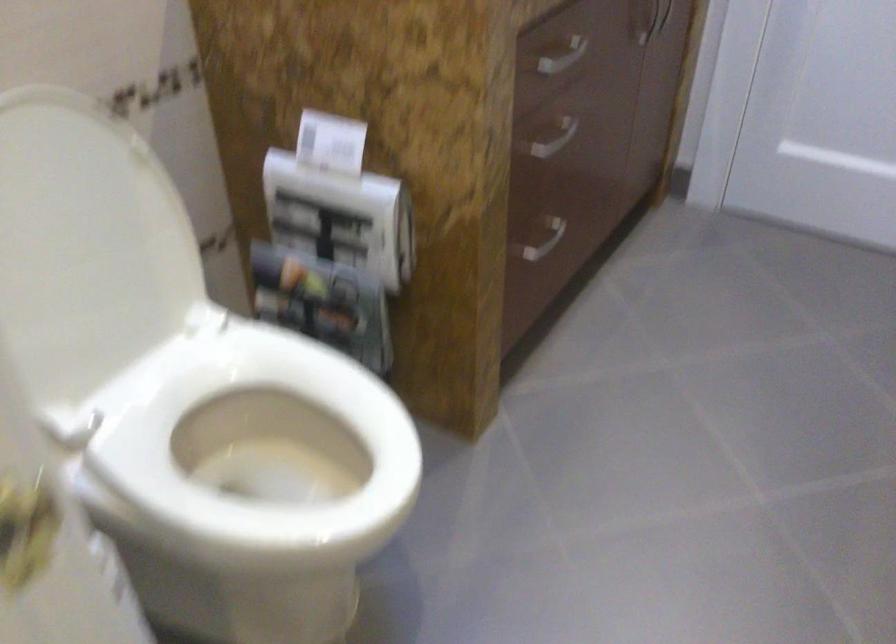
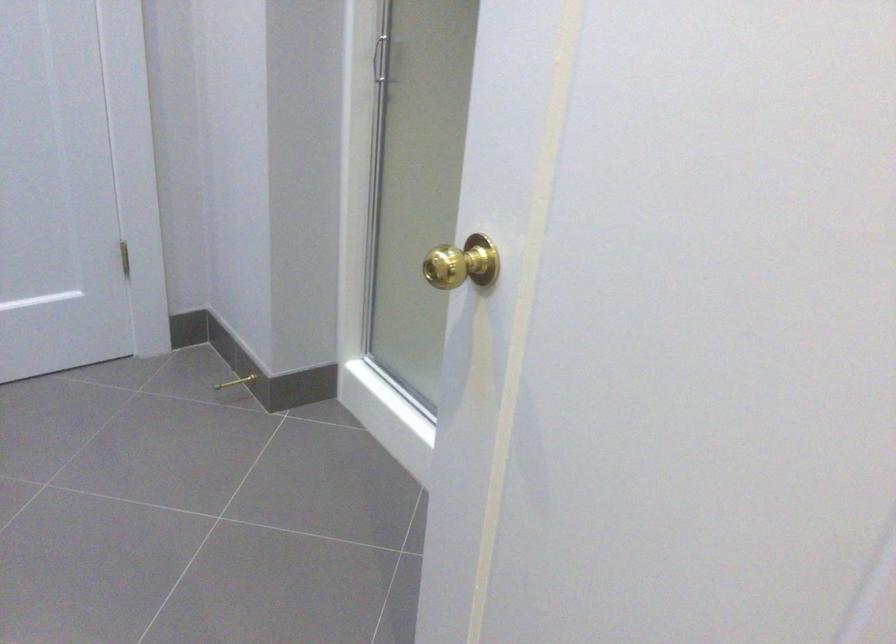
Question: The camera is either moving clockwise (left) or counter-clockwise (right) around the object. The first image is from the beginning of the video and the second image is from the end. Is the camera moving left or right when shooting the video?

Choices:
 (A) Left
 (B) Right

Answer: (A)